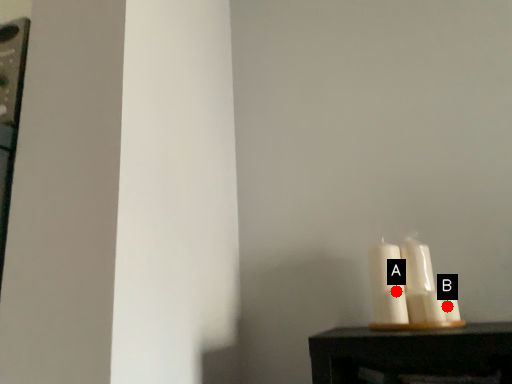
Question: Two points are circled on the image, labeled by A and B beside each circle. Which point is further to the camera?

Choices:
 (A) A is further
 (B) B is further

Answer: (A)